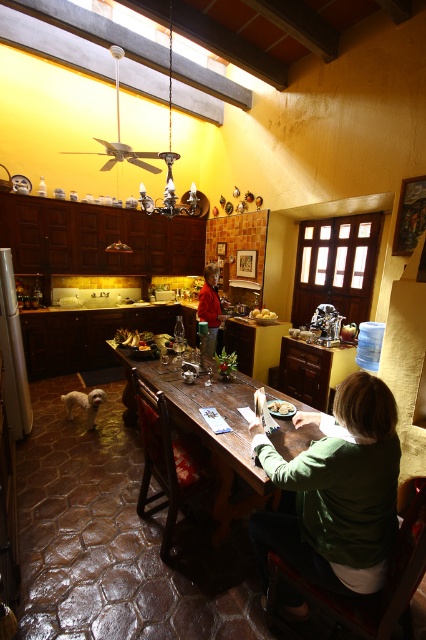
You are a guest at this rustic kitchen and want to place a small vase on the table. The vase needs to be above the yellow matte potatoes at center. Can you place it on the matte silver tray at center?

The matte silver tray at center is below the yellow matte potatoes at center, so placing the vase on the tray would not satisfy the requirement of being above the potatoes. You need to find another spot on the table that is positioned above the yellow matte potatoes at center.